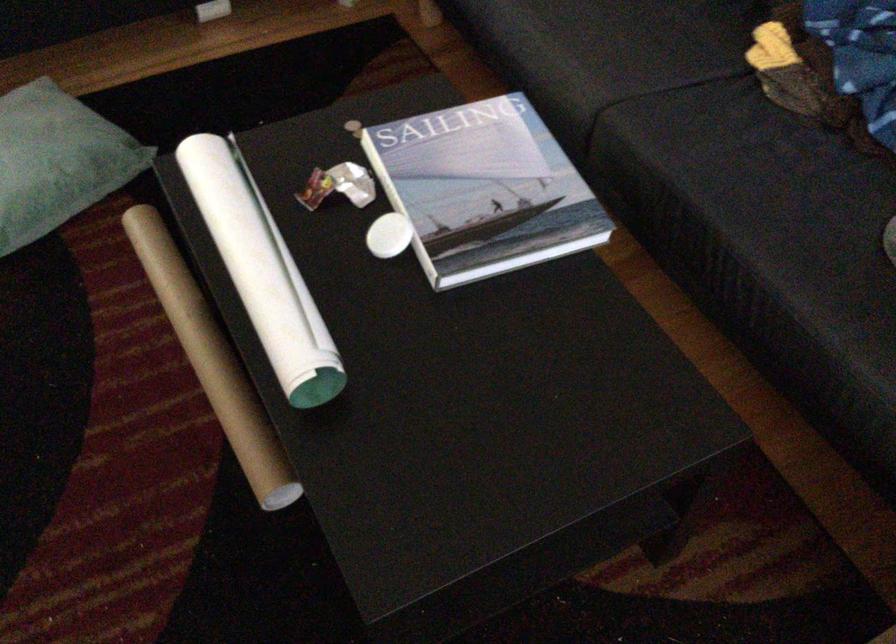
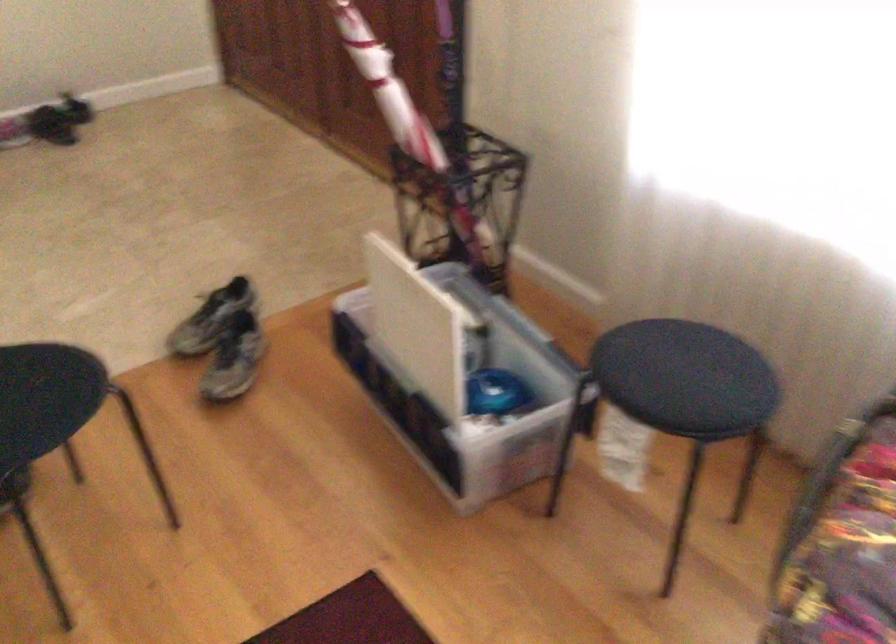
First-person continuous shooting, in which direction is the camera rotating?

The camera's rotation is toward right-down.